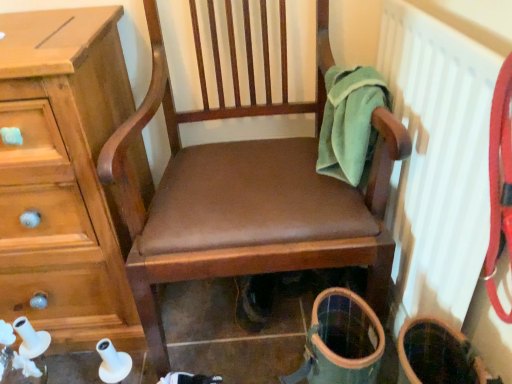
Question: From a real-world perspective, is green fleece towel at upper right above or below brown leather chair at center?

Choices:
 (A) above
 (B) below

Answer: (A)

Question: Relative to brown leather chair at center, is green fleece towel at upper right in front or behind?

Choices:
 (A) behind
 (B) front

Answer: (A)

Question: Estimate the real-world distances between objects in this image. Which object is closer to the green fleece towel at upper right?

Choices:
 (A) brown leather chair at center
 (B) wooden chest of drawers at left
 (C) white textured radiator at upper right

Answer: (C)

Question: Which of these objects is positioned farthest from the brown leather chair at center?

Choices:
 (A) wooden chest of drawers at left
 (B) white textured radiator at upper right
 (C) green fleece towel at upper right

Answer: (B)